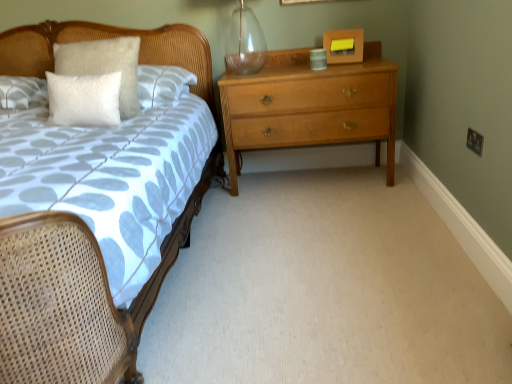
Locate an element on the screen. free point below light brown wood chest of drawers at center (from a real-world perspective) is located at coordinates (302, 177).